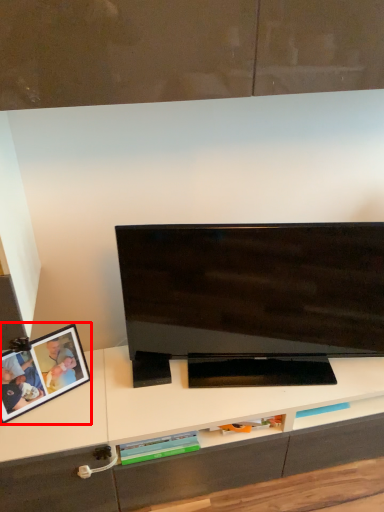
Question: From the image's perspective, what is the correct spatial relationship of picture frame (annotated by the red box) in relation to television?

Choices:
 (A) below
 (B) above

Answer: (A)